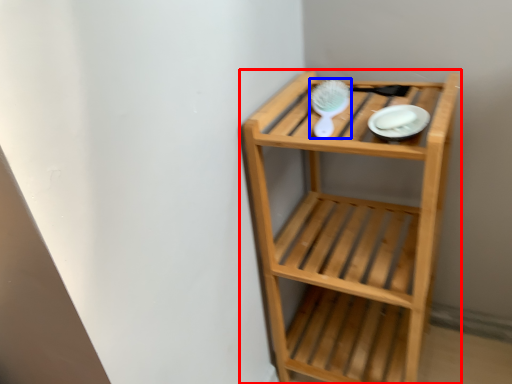
Question: Which object appears closest to the camera in this image, shelf (highlighted by a red box) or brush (highlighted by a blue box)?

Choices:
 (A) shelf
 (B) brush

Answer: (A)